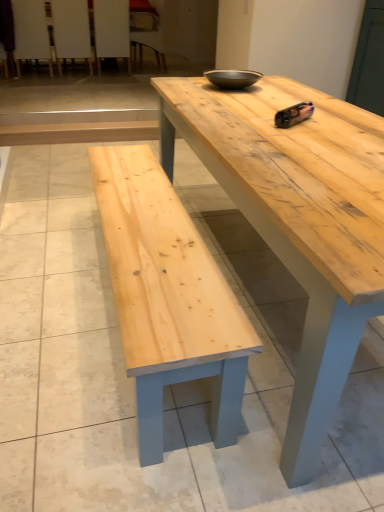
Locate an element on the screen. vacant region to the left of matte black bowl at center is located at coordinates (188, 84).